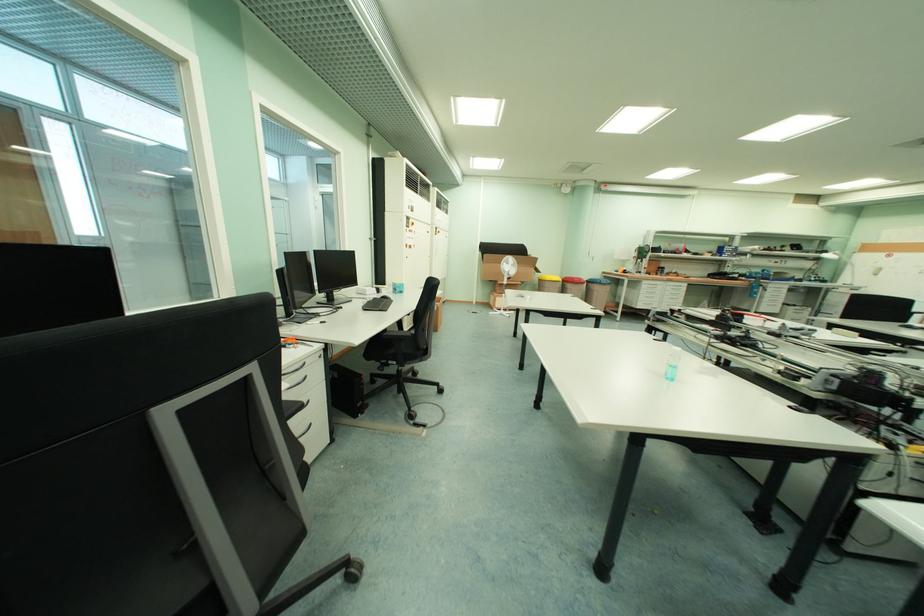
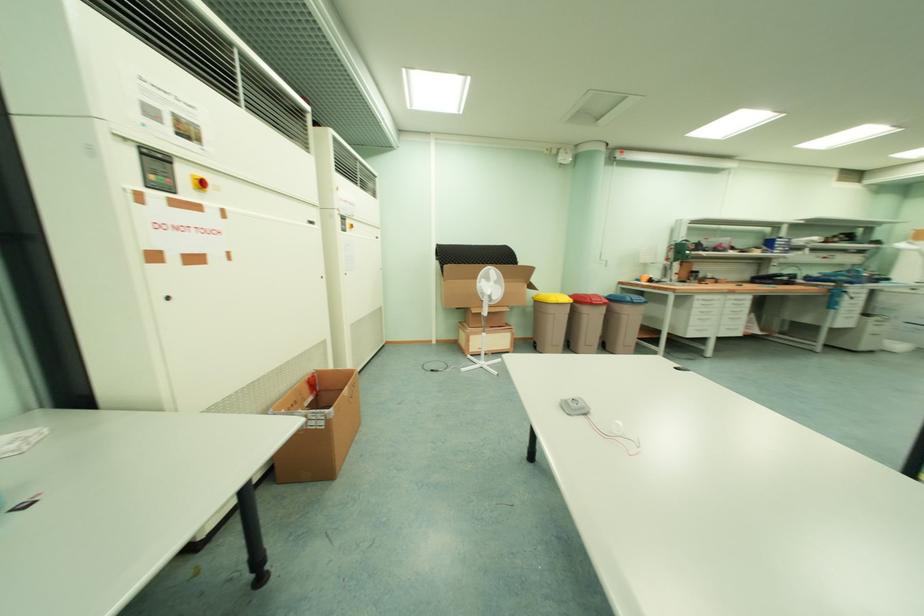
Question: Which direction would the cameraman need to move to produce the second image? Reply with the corresponding letter.

Choices:
 (A) Left
 (B) Right
 (C) Forward
 (D) Backward

Answer: (C)